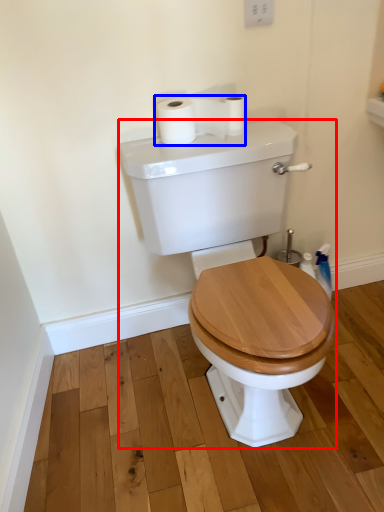
Question: Which object is closer to the camera taking this photo, porcelain (highlighted by a red box) or toilet paper (highlighted by a blue box)?

Choices:
 (A) porcelain
 (B) toilet paper

Answer: (A)